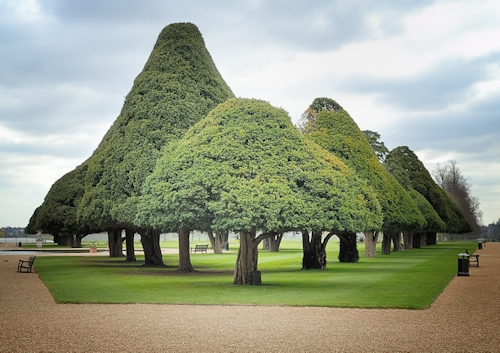
At what (x,y) coordinates should I click in order to perform the action: click on trashcan. Please return your answer as a coordinate pair (x, y). Looking at the image, I should click on (463, 267), (479, 244).